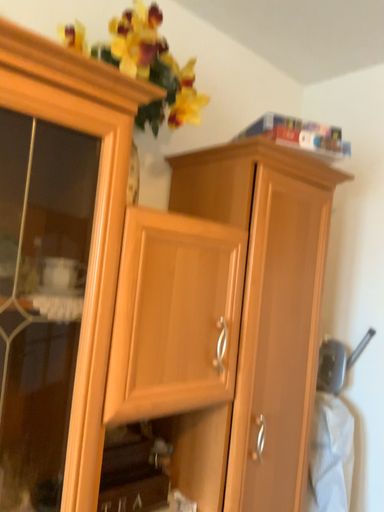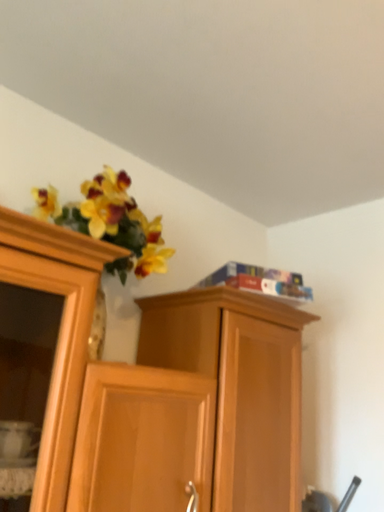
Question: Which way did the camera rotate in the video?

Choices:
 (A) rotated upward
 (B) rotated downward

Answer: (A)